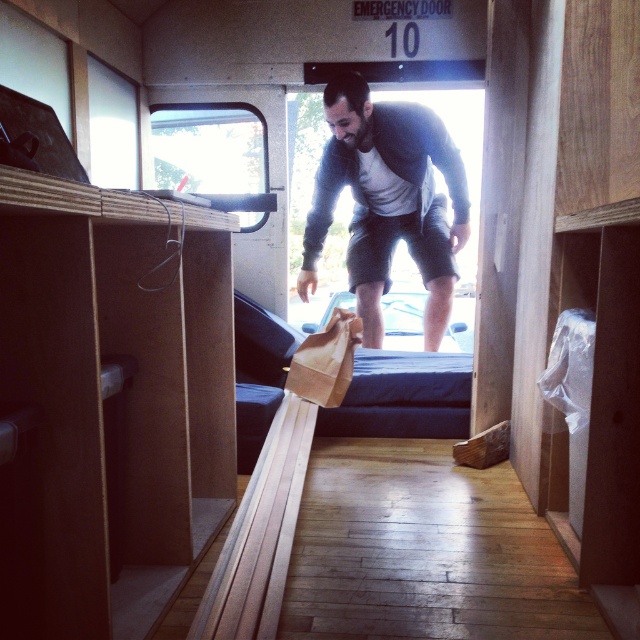
Question: Does gray cotton shirt at center come in front of dark blue fabric bed at center?

Choices:
 (A) no
 (B) yes

Answer: (B)

Question: Among these objects, which one is nearest to the camera?

Choices:
 (A) gray cotton shirt at center
 (B) dark blue fabric bed at center

Answer: (A)

Question: Among these points, which one is nearest to the camera?

Choices:
 (A) coord(396,218)
 (B) coord(253,316)

Answer: (B)

Question: Is gray cotton shirt at center behind dark blue fabric bed at center?

Choices:
 (A) yes
 (B) no

Answer: (B)

Question: In this image, where is gray cotton shirt at center located relative to dark blue fabric bed at center?

Choices:
 (A) above
 (B) below

Answer: (A)